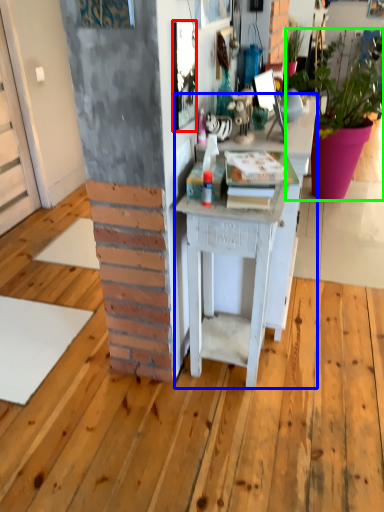
Question: Which is nearer to the picture frame (highlighted by a red box)? desk (highlighted by a blue box) or houseplant (highlighted by a green box).

Choices:
 (A) desk
 (B) houseplant

Answer: (A)